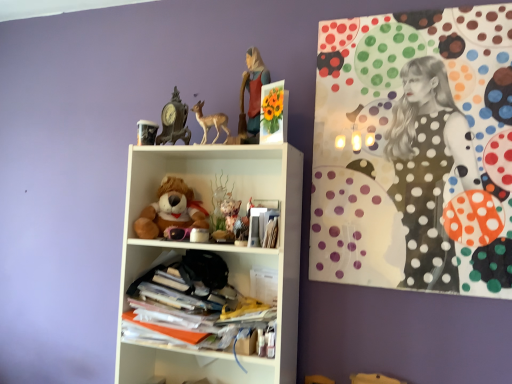
What is the approximate width of matte plastic figurine at upper center?

matte plastic figurine at upper center is 4.20 inches in width.

The image size is (512, 384). In order to click on matte plastic figurine at upper center in this screenshot , I will do `click(252, 95)`.

Where is `matte brown deer at upper center`? The width and height of the screenshot is (512, 384). matte brown deer at upper center is located at coordinates (210, 122).

This screenshot has height=384, width=512. Identify the location of matte paper magazine at center. (263, 224).

Find the location of a particular element. stacked papers at center, which is the second shelf in top-to-bottom order is located at coordinates (199, 298).

Locate an element on the screen. The image size is (512, 384). antique bronze clock at upper center is located at coordinates (174, 121).

Identify the location of soft plush teddy bear at center. Image resolution: width=512 pixels, height=384 pixels. click(170, 210).

Where is `matte plastic figurine at upper center`? matte plastic figurine at upper center is located at coordinates (252, 95).

In the scene shown: Can you confirm if matte plastic figurine at upper center is smaller than matte brown deer at upper center?

No, matte plastic figurine at upper center is not smaller than matte brown deer at upper center.

From a real-world perspective, does matte plastic figurine at upper center stand above matte brown deer at upper center?

Indeed, from a real-world perspective, matte plastic figurine at upper center stands above matte brown deer at upper center.

Looking at this image, is the position of matte plastic figurine at upper center less distant than that of matte brown deer at upper center?

Yes, it is.

Would you say soft plush teddy bear at center is inside or outside stacked papers at center, which is the 1th shelf in bottom-to-top order?

soft plush teddy bear at center is not enclosed by stacked papers at center, which is the 1th shelf in bottom-to-top order.

Based on the photo, would you consider soft plush teddy bear at center to be distant from stacked papers at center, which is the second shelf in top-to-bottom order?

They are positioned close to each other.

Considering the relative sizes of soft plush teddy bear at center and stacked papers at center, which is the 1th shelf in bottom-to-top order, in the image provided, is soft plush teddy bear at center thinner than stacked papers at center, which is the 1th shelf in bottom-to-top order,?

Correct, the width of soft plush teddy bear at center is less than that of stacked papers at center, which is the 1th shelf in bottom-to-top order.

Which of these two, soft plush teddy bear at center or stacked papers at center, which is the second shelf in top-to-bottom order, stands taller?

soft plush teddy bear at center.

Would you say soft plush teddy bear at center is a long distance from polka dot canvas at upper right?

No, soft plush teddy bear at center is not far from polka dot canvas at upper right.

How different are the orientations of soft plush teddy bear at center and polka dot canvas at upper right in degrees?

The angle between the facing direction of soft plush teddy bear at center and the facing direction of polka dot canvas at upper right is 0.00243 degrees.

Considering the relative positions of soft plush teddy bear at center and polka dot canvas at upper right in the image provided, is soft plush teddy bear at center behind polka dot canvas at upper right?

Yes, it is.

Consider the image. Does soft plush teddy bear at center have a smaller size compared to polka dot canvas at upper right?

Yes, soft plush teddy bear at center is smaller than polka dot canvas at upper right.

What's the angular difference between polka dot canvas at upper right and stacked papers at center, which is the 1th shelf in bottom-to-top order,'s facing directions?

The angle between the facing direction of polka dot canvas at upper right and the facing direction of stacked papers at center, which is the 1th shelf in bottom-to-top order, is 1.41 degrees.

From the image's perspective, which is below, polka dot canvas at upper right or stacked papers at center, which is the 1th shelf in bottom-to-top order?

stacked papers at center, which is the 1th shelf in bottom-to-top order, from the image's perspective.

Consider the image. Does polka dot canvas at upper right appear on the left side of stacked papers at center, which is the 1th shelf in bottom-to-top order?

No, polka dot canvas at upper right is not to the left of stacked papers at center, which is the 1th shelf in bottom-to-top order.

Could you tell me if polka dot canvas at upper right is turned towards stacked papers at center, which is the 1th shelf in bottom-to-top order?

No.

Is point (214, 124) closer to viewer compared to point (163, 129)?

Yes, it is in front of point (163, 129).

Is matte brown deer at upper center thinner than antique bronze clock at upper center?

Indeed, matte brown deer at upper center has a lesser width compared to antique bronze clock at upper center.

Is matte brown deer at upper center at the left side of antique bronze clock at upper center?

In fact, matte brown deer at upper center is to the right of antique bronze clock at upper center.

Which point is more forward, (276,275) or (200,117)?

Point (200,117)

Is the position of stacked papers at center, which is the second shelf in top-to-bottom order, more distant than that of matte brown deer at upper center?

That is False.

Is stacked papers at center, which is the 1th shelf in bottom-to-top order, positioned beyond the bounds of matte brown deer at upper center?

stacked papers at center, which is the 1th shelf in bottom-to-top order, lies outside matte brown deer at upper center's area.

How different are the orientations of stacked papers at center, which is the second shelf in top-to-bottom order, and matte brown deer at upper center in degrees?

0.311 degrees.

Is white matte shelf at center, which is the 1th shelf from top to bottom, placed right next to stacked papers at center, which is the second shelf in top-to-bottom order?

No.

Does white matte shelf at center, which is the 1th shelf from top to bottom, appear on the right side of stacked papers at center, which is the 1th shelf in bottom-to-top order?

Yes, white matte shelf at center, which is the 1th shelf from top to bottom, is to the right of stacked papers at center, which is the 1th shelf in bottom-to-top order.

Is stacked papers at center, which is the second shelf in top-to-bottom order, at the back of white matte shelf at center, which is the 1th shelf from top to bottom?

Correct, white matte shelf at center, which is the 1th shelf from top to bottom, is looking away from stacked papers at center, which is the second shelf in top-to-bottom order.

Which of these two, white matte shelf at center, placed as the 2th shelf when sorted from bottom to top, or stacked papers at center, which is the second shelf in top-to-bottom order, is thinner?

white matte shelf at center, placed as the 2th shelf when sorted from bottom to top.

Identify the location of girl positioned vertically above the matte brown deer at upper center (from a real-world perspective). The image size is (512, 384). (252, 95).

The height and width of the screenshot is (384, 512). Find the location of `teddy bear behind the stacked papers at center, which is the second shelf in top-to-bottom order`. teddy bear behind the stacked papers at center, which is the second shelf in top-to-bottom order is located at coordinates (170, 210).

Considering their positions, is antique bronze clock at upper center positioned further to stacked papers at center, which is the second shelf in top-to-bottom order, than white matte shelf at center, which is the 1th shelf from top to bottom?

Based on the image, antique bronze clock at upper center appears to be further to stacked papers at center, which is the second shelf in top-to-bottom order.

Looking at the image, which one is located further to antique bronze clock at upper center, soft plush teddy bear at center or matte brown deer at upper center?

soft plush teddy bear at center lies further to antique bronze clock at upper center than the other object.

Based on their spatial positions, is matte paper magazine at center or polka dot canvas at upper right closer to antique bronze clock at upper center?

matte paper magazine at center is closer to antique bronze clock at upper center.

Which object lies further to the anchor point stacked papers at center, which is the 1th shelf in bottom-to-top order, polka dot canvas at upper right or antique bronze clock at upper center?

polka dot canvas at upper right is positioned further to the anchor stacked papers at center, which is the 1th shelf in bottom-to-top order.

Considering their positions, is soft plush teddy bear at center positioned closer to antique bronze clock at upper center than matte paper magazine at center?

Based on the image, soft plush teddy bear at center appears to be nearer to antique bronze clock at upper center.

Looking at the image, which one is located further to stacked papers at center, which is the second shelf in top-to-bottom order, white matte shelf at center, placed as the 2th shelf when sorted from bottom to top, or matte brown deer at upper center?

Based on the image, matte brown deer at upper center appears to be further to stacked papers at center, which is the second shelf in top-to-bottom order.

When comparing their distances from matte brown deer at upper center, does stacked papers at center, which is the second shelf in top-to-bottom order, or white matte shelf at center, which is the 1th shelf from top to bottom, seem further?

The object further to matte brown deer at upper center is stacked papers at center, which is the second shelf in top-to-bottom order.

Estimate the real-world distances between objects in this image. Which object is further from stacked papers at center, which is the second shelf in top-to-bottom order, antique bronze clock at upper center or matte brown deer at upper center?

matte brown deer at upper center is further to stacked papers at center, which is the second shelf in top-to-bottom order.

Where is `magazine located between matte brown deer at upper center and polka dot canvas at upper right in the left-right direction`? magazine located between matte brown deer at upper center and polka dot canvas at upper right in the left-right direction is located at coordinates click(263, 224).

You are a GUI agent. You are given a task and a screenshot of the screen. Output one action in this format:
    pyautogui.click(x=<x>, y=<y>)
    Task: Click on the toy situated between antique bronze clock at upper center and matte plastic figurine at upper center from left to right
    The image size is (512, 384).
    Given the screenshot: What is the action you would take?
    pyautogui.click(x=210, y=122)

Locate an element on the screen. shelf between antique bronze clock at upper center and stacked papers at center, which is the second shelf in top-to-bottom order, from top to bottom is located at coordinates (217, 253).

You are a GUI agent. You are given a task and a screenshot of the screen. Output one action in this format:
    pyautogui.click(x=<x>, y=<y>)
    Task: Click on the teddy bear between antique bronze clock at upper center and polka dot canvas at upper right
    
    Given the screenshot: What is the action you would take?
    pyautogui.click(x=170, y=210)